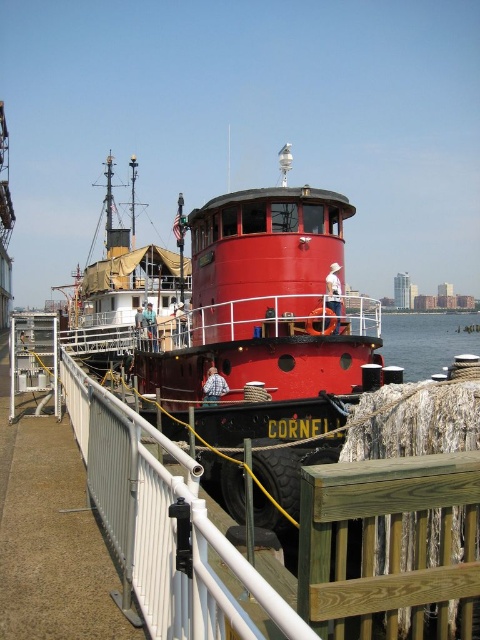
Does shiny red boat at center have a greater width compared to brushed metal boat at center?

In fact, shiny red boat at center might be narrower than brushed metal boat at center.

Is point (226, 378) positioned behind point (165, 284)?

No, it is not.

This screenshot has height=640, width=480. What do you see at coordinates (265, 330) in the screenshot? I see `shiny red boat at center` at bounding box center [265, 330].

What are the coordinates of `shiny red boat at center` in the screenshot? It's located at (265, 330).